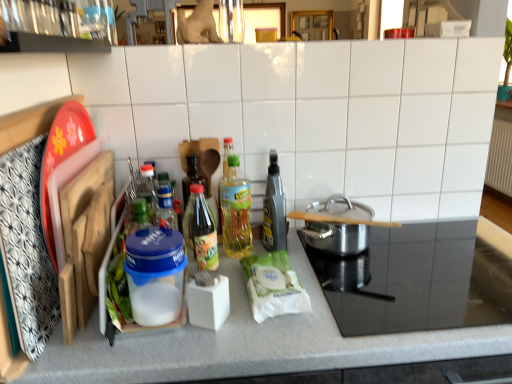
Where is `blank space situated above white matte countertop at center (from a real-world perspective)`? The width and height of the screenshot is (512, 384). blank space situated above white matte countertop at center (from a real-world perspective) is located at coordinates (369, 284).